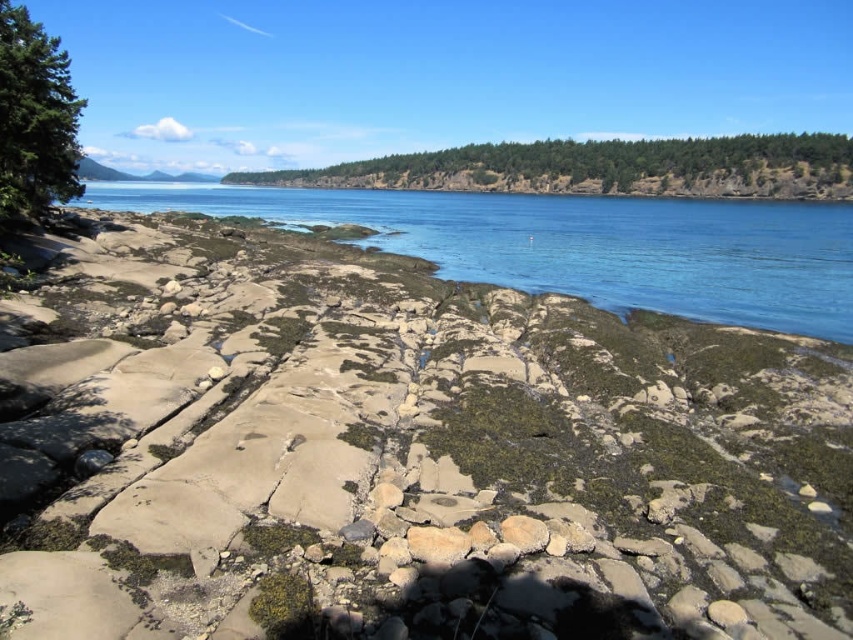
Question: Is smooth sandstone rocks at center further to the viewer compared to green matte tree at upper left?

Choices:
 (A) no
 (B) yes

Answer: (A)

Question: Which object is farther from the camera taking this photo?

Choices:
 (A) green leafy forest at upper center
 (B) blue water at center
 (C) smooth sandstone rocks at center
 (D) green matte tree at upper left

Answer: (A)

Question: In this image, where is blue water at center located relative to green matte tree at upper left?

Choices:
 (A) below
 (B) above

Answer: (B)

Question: Can you confirm if blue water at center is positioned below green matte tree at upper left?

Choices:
 (A) no
 (B) yes

Answer: (A)

Question: Which of the following is the farthest from the observer?

Choices:
 (A) pyautogui.click(x=761, y=161)
 (B) pyautogui.click(x=367, y=296)
 (C) pyautogui.click(x=33, y=204)

Answer: (A)

Question: Estimate the real-world distances between objects in this image. Which object is farther from the blue water at center?

Choices:
 (A) green matte tree at upper left
 (B) green leafy forest at upper center

Answer: (A)